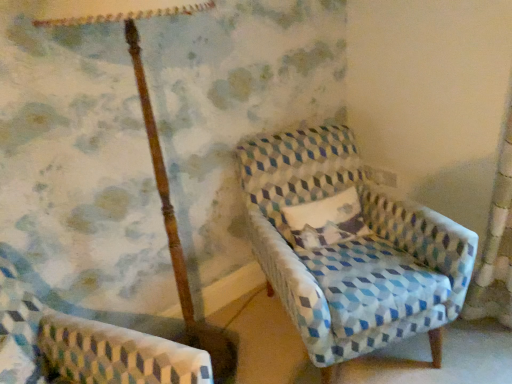
Measure the distance between point (x=64, y=357) and camera.

4.40 feet.

Find the location of a particular element. The height and width of the screenshot is (384, 512). patterned fabric armchair at lower left, which appears as the first chair when viewed from the left is located at coordinates (87, 344).

Measure the distance between textured blue and white armchair at center, which is counted as the second chair, starting from the left, and camera.

textured blue and white armchair at center, which is counted as the second chair, starting from the left, and camera are 4.57 feet apart.

Image resolution: width=512 pixels, height=384 pixels. Find the location of `textured cream pillow at center`. textured cream pillow at center is located at coordinates (326, 220).

The image size is (512, 384). Identify the location of wooden pole at upper left. (152, 144).

From the image's perspective, which object appears higher, wooden pole at upper left or patterned fabric armchair at lower left, marked as the second chair in a right-to-left arrangement?

wooden pole at upper left, from the image's perspective.

Is wooden pole at upper left in front of patterned fabric armchair at lower left, marked as the second chair in a right-to-left arrangement?

No, it is not.

Considering the positions of points (178, 4) and (59, 344), is point (178, 4) closer to camera compared to point (59, 344)?

Yes, point (178, 4) is closer to viewer.

Considering the sizes of objects wooden pole at upper left and patterned fabric armchair at lower left, which appears as the first chair when viewed from the left, in the image provided, who is smaller, wooden pole at upper left or patterned fabric armchair at lower left, which appears as the first chair when viewed from the left,?

patterned fabric armchair at lower left, which appears as the first chair when viewed from the left.

Between textured blue and white armchair at center, which is counted as the second chair, starting from the left, and wooden pole at upper left, which one appears on the left side from the viewer's perspective?

Positioned to the left is wooden pole at upper left.

Between point (327, 294) and point (50, 19), which one is positioned behind?

Positioned behind is point (327, 294).

From a real-world perspective, which object stands above the other?

In real-world perspective, wooden pole at upper left is above.

This screenshot has width=512, height=384. What are the coordinates of `the 1st chair below the wooden pole at upper left (from the image's perspective)` in the screenshot? It's located at pyautogui.click(x=349, y=247).

From a real-world perspective, is textured blue and white armchair at center, which is the 1th chair from right to left, physically below textured cream pillow at center?

Yes, from a real-world perspective, textured blue and white armchair at center, which is the 1th chair from right to left, is below textured cream pillow at center.

Which is correct: textured blue and white armchair at center, which is the 1th chair from right to left, is inside textured cream pillow at center, or outside of it?

textured blue and white armchair at center, which is the 1th chair from right to left, lies outside textured cream pillow at center.

Can you tell me how much textured blue and white armchair at center, which is counted as the second chair, starting from the left, and textured cream pillow at center differ in facing direction?

They differ by 1.94 degrees in their facing directions.

From a real-world perspective, count 2nd chairs downward from the textured cream pillow at center and point to it. Please provide its 2D coordinates.

[(349, 247)]

Consider the image. How many degrees apart are the facing directions of wooden pole at upper left and textured cream pillow at center?

24 degrees separate the facing orientations of wooden pole at upper left and textured cream pillow at center.

Does wooden pole at upper left have a lesser height compared to textured cream pillow at center?

No.

Looking at this image, from a real-world perspective, between wooden pole at upper left and textured cream pillow at center, who is vertically lower?

In real-world perspective, textured cream pillow at center is lower.

From the image's perspective, would you say wooden pole at upper left is positioned over textured cream pillow at center?

Yes, from the image's perspective, wooden pole at upper left is over textured cream pillow at center.

Which object is positioned more to the right, textured cream pillow at center or patterned fabric armchair at lower left, marked as the second chair in a right-to-left arrangement?

From the viewer's perspective, textured cream pillow at center appears more on the right side.

Is textured cream pillow at center positioned far away from patterned fabric armchair at lower left, marked as the second chair in a right-to-left arrangement?

textured cream pillow at center is actually quite close to patterned fabric armchair at lower left, marked as the second chair in a right-to-left arrangement.

Is textured cream pillow at center in front of patterned fabric armchair at lower left, which appears as the first chair when viewed from the left?

No, it is not.

You are a GUI agent. You are given a task and a screenshot of the screen. Output one action in this format:
    pyautogui.click(x=<x>, y=<y>)
    Task: Click on the pillow that is behind the patterned fabric armchair at lower left, which appears as the first chair when viewed from the left
    Image resolution: width=512 pixels, height=384 pixels.
    Given the screenshot: What is the action you would take?
    pyautogui.click(x=326, y=220)

Considering the sizes of patterned fabric armchair at lower left, marked as the second chair in a right-to-left arrangement, and textured cream pillow at center in the image, is patterned fabric armchair at lower left, marked as the second chair in a right-to-left arrangement, taller or shorter than textured cream pillow at center?

Considering their sizes, patterned fabric armchair at lower left, marked as the second chair in a right-to-left arrangement, has more height than textured cream pillow at center.

How different are the orientations of patterned fabric armchair at lower left, which appears as the first chair when viewed from the left, and textured cream pillow at center in degrees?

43.6 degrees.

Between patterned fabric armchair at lower left, which appears as the first chair when viewed from the left, and textured cream pillow at center, which one is positioned in front?

Positioned in front is patterned fabric armchair at lower left, which appears as the first chair when viewed from the left.

Is wooden pole at upper left completely or partially inside patterned fabric armchair at lower left, marked as the second chair in a right-to-left arrangement?

No, wooden pole at upper left is not surrounded by patterned fabric armchair at lower left, marked as the second chair in a right-to-left arrangement.

Does patterned fabric armchair at lower left, marked as the second chair in a right-to-left arrangement, have a lesser width compared to wooden pole at upper left?

Incorrect, the width of patterned fabric armchair at lower left, marked as the second chair in a right-to-left arrangement, is not less than that of wooden pole at upper left.

Between patterned fabric armchair at lower left, which appears as the first chair when viewed from the left, and wooden pole at upper left, which one has larger size?

wooden pole at upper left is bigger.

Locate an element on the screen. The width and height of the screenshot is (512, 384). table lamp lying behind the patterned fabric armchair at lower left, which appears as the first chair when viewed from the left is located at coordinates (152, 144).

This screenshot has width=512, height=384. I want to click on table lamp on the left of the textured blue and white armchair at center, which is counted as the second chair, starting from the left, so click(152, 144).

Which object lies nearer to the anchor point wooden pole at upper left, textured cream pillow at center or textured blue and white armchair at center, which is counted as the second chair, starting from the left?

textured cream pillow at center is closer to wooden pole at upper left.

Which object lies nearer to the anchor point textured cream pillow at center, textured blue and white armchair at center, which is the 1th chair from right to left, or wooden pole at upper left?

Based on the image, textured blue and white armchair at center, which is the 1th chair from right to left, appears to be nearer to textured cream pillow at center.

In the scene shown: Estimate the real-world distances between objects in this image. Which object is closer to textured blue and white armchair at center, which is counted as the second chair, starting from the left, wooden pole at upper left or patterned fabric armchair at lower left, marked as the second chair in a right-to-left arrangement?

Result: wooden pole at upper left.

Which object lies further to the anchor point patterned fabric armchair at lower left, which appears as the first chair when viewed from the left, textured blue and white armchair at center, which is the 1th chair from right to left, or textured cream pillow at center?

The object further to patterned fabric armchair at lower left, which appears as the first chair when viewed from the left, is textured cream pillow at center.

Looking at the image, which one is located closer to textured cream pillow at center, patterned fabric armchair at lower left, marked as the second chair in a right-to-left arrangement, or textured blue and white armchair at center, which is counted as the second chair, starting from the left?

textured blue and white armchair at center, which is counted as the second chair, starting from the left.

Based on their spatial positions, is textured blue and white armchair at center, which is the 1th chair from right to left, or patterned fabric armchair at lower left, which appears as the first chair when viewed from the left, closer to textured cream pillow at center?

textured blue and white armchair at center, which is the 1th chair from right to left, is closer to textured cream pillow at center.

Based on their spatial positions, is patterned fabric armchair at lower left, marked as the second chair in a right-to-left arrangement, or textured blue and white armchair at center, which is counted as the second chair, starting from the left, further from wooden pole at upper left?

textured blue and white armchair at center, which is counted as the second chair, starting from the left, is further to wooden pole at upper left.

Which object lies further to the anchor point wooden pole at upper left, patterned fabric armchair at lower left, which appears as the first chair when viewed from the left, or textured cream pillow at center?

textured cream pillow at center is further to wooden pole at upper left.

Where is `chair positioned between wooden pole at upper left and textured cream pillow at center from near to far`? This screenshot has width=512, height=384. chair positioned between wooden pole at upper left and textured cream pillow at center from near to far is located at coordinates (349, 247).

The image size is (512, 384). I want to click on table lamp located between patterned fabric armchair at lower left, which appears as the first chair when viewed from the left, and textured blue and white armchair at center, which is counted as the second chair, starting from the left, in the left-right direction, so click(152, 144).

Find the location of a particular element. This screenshot has width=512, height=384. chair between patterned fabric armchair at lower left, marked as the second chair in a right-to-left arrangement, and textured cream pillow at center from front to back is located at coordinates click(349, 247).

Locate an element on the screen. table lamp between patterned fabric armchair at lower left, which appears as the first chair when viewed from the left, and textured cream pillow at center from front to back is located at coordinates (152, 144).